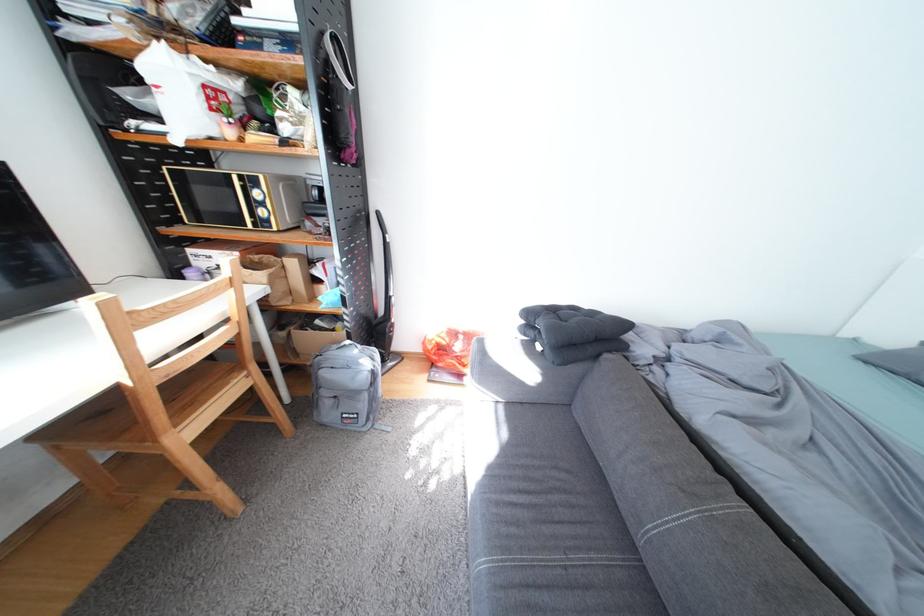
Identify the location of grey sofa sitting surface. (540, 517).